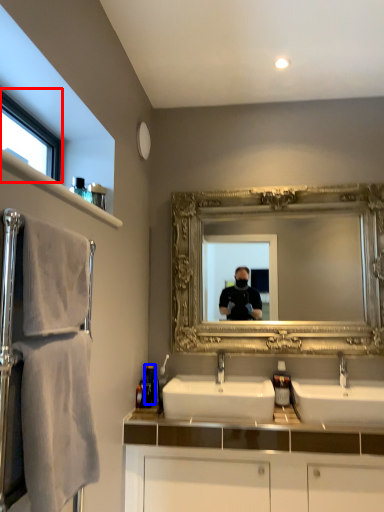
Question: Which of the following is the closest to the observer, window (highlighted by a red box) or toiletry (highlighted by a blue box)?

Choices:
 (A) window
 (B) toiletry

Answer: (A)